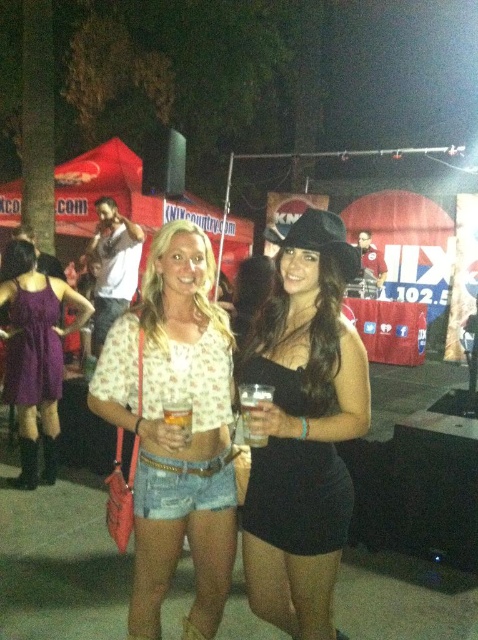
You are standing at the back of the crowd at the concert. You see two points in the image, point 1 at coordinates point (195, 528) and point 2 at coordinates point (62, 380). Which point is closer to you?

Point (195, 528) is closer to the camera than point (62, 380), so point 1 is closer to you.

You are at the event and want to take a photo with both the black satin dress at lower right and the purple satin dress at left. Which dress should you position closer to the right side of the frame to include both in the photo?

You should position the black satin dress at lower right closer to the right side of the frame since it is already to the right of the purple satin dress at left.